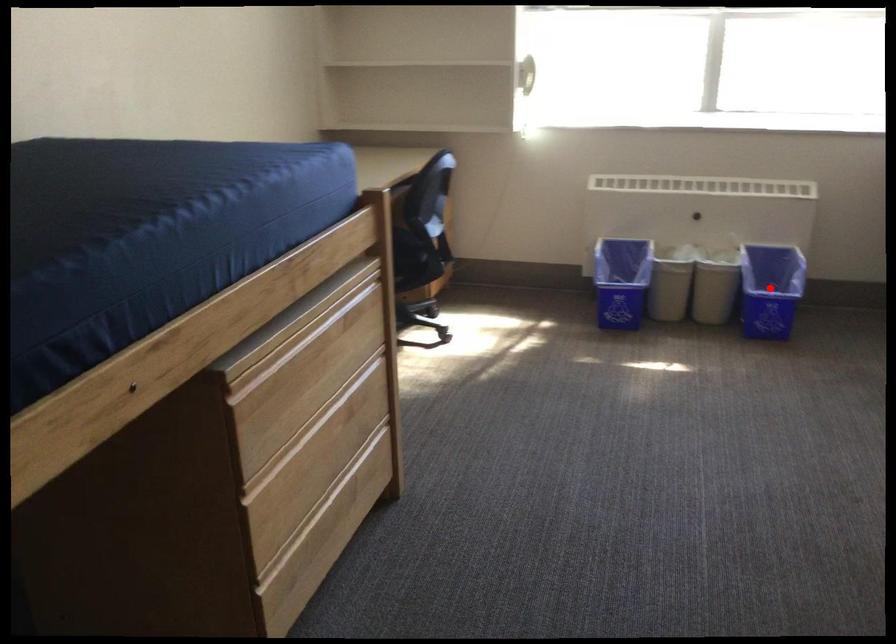
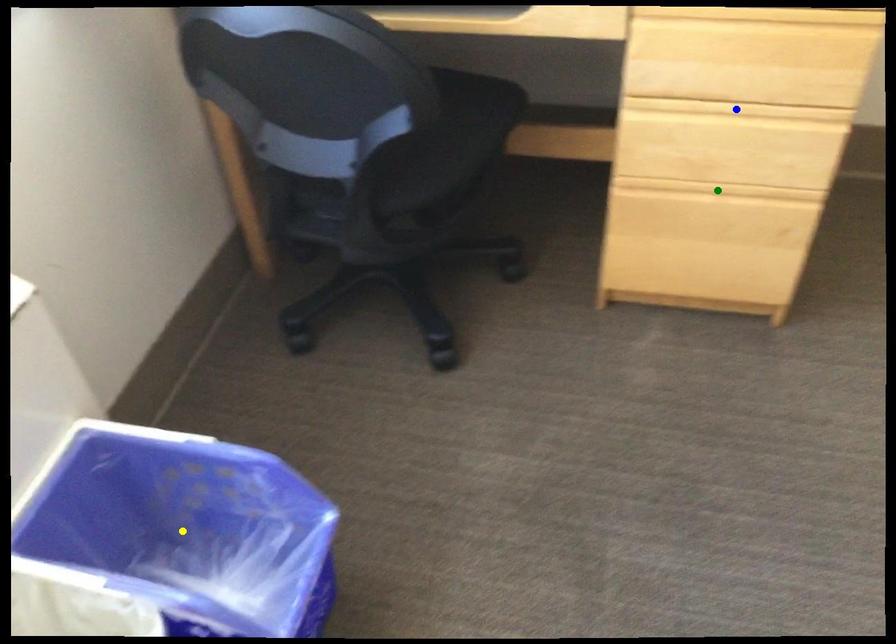
Question: I am providing you with two images of the same scene from different viewpoints. A red point is marked on the first image. You are given multiple points on the second image. Which mark in image 2 goes with the point in image 1?

Choices:
 (A) blue point
 (B) yellow point
 (C) green point

Answer: (B)